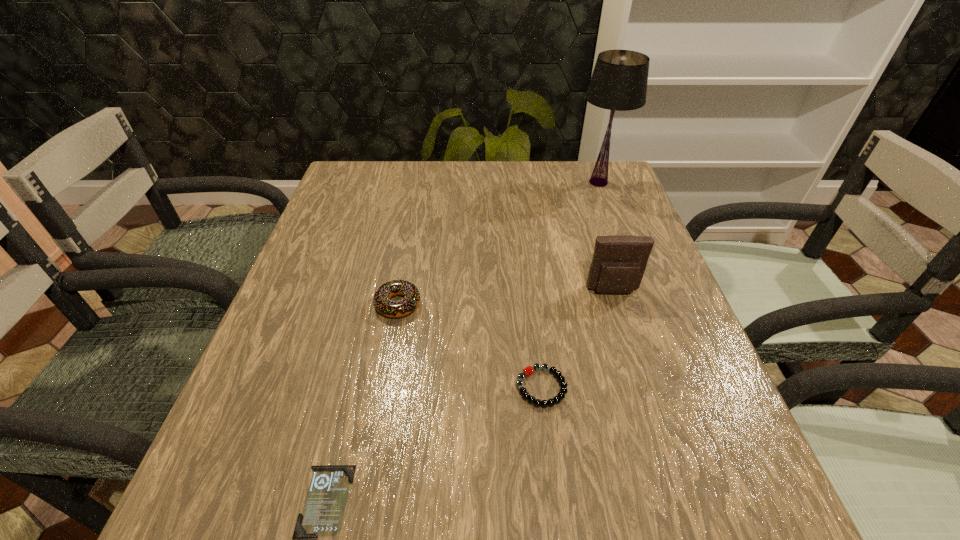
At what (x,y) coordinates should I click in order to perform the action: click on the tallest object. Please return your answer as a coordinate pair (x, y). Looking at the image, I should click on (619, 81).

You are a GUI agent. You are given a task and a screenshot of the screen. Output one action in this format:
    pyautogui.click(x=<x>, y=<y>)
    Task: Click on the farthest object
    The width and height of the screenshot is (960, 540).
    Given the screenshot: What is the action you would take?
    pyautogui.click(x=619, y=81)

The height and width of the screenshot is (540, 960). I want to click on pouch, so click(619, 261).

Locate an element on the screen. This screenshot has width=960, height=540. the third tallest object is located at coordinates (x=404, y=307).

Find the location of `the third object from left to right`. the third object from left to right is located at coordinates (529, 370).

Where is `the fourth farthest object`? The height and width of the screenshot is (540, 960). the fourth farthest object is located at coordinates (529, 370).

Find the location of a particular element. identity card is located at coordinates coord(322,515).

Where is `the nearest object`? the nearest object is located at coordinates pos(322,515).

At what (x,y) coordinates should I click in order to perform the action: click on vacant area situated on the front-facing side of the farthest object. Please return your answer as a coordinate pair (x, y). Looking at the image, I should click on (470, 182).

Locate an element on the screen. This screenshot has width=960, height=540. vacant region located 0.250m on the front-facing side of the farthest object is located at coordinates (485, 182).